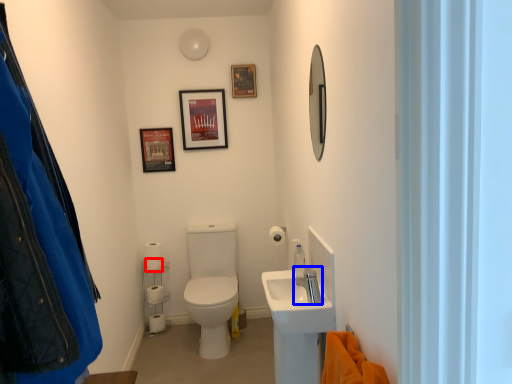
Question: Among these objects, which one is farthest to the camera, toilet paper (highlighted by a red box) or tap (highlighted by a blue box)?

Choices:
 (A) toilet paper
 (B) tap

Answer: (A)